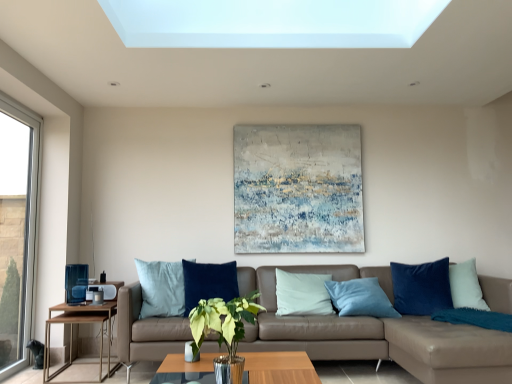
At what (x,y) coordinates should I click in order to perform the action: click on free space above clear glass window at left (from a real-world perspective). Please return your answer as a coordinate pair (x, y). The height and width of the screenshot is (384, 512). Looking at the image, I should click on (14, 110).